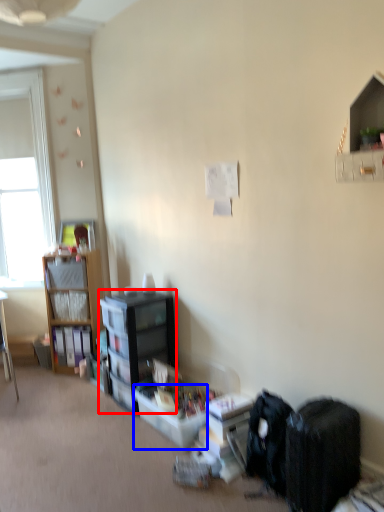
Question: Which object appears closest to the camera in this image, bookcase (highlighted by a red box) or storage box (highlighted by a blue box)?

Choices:
 (A) bookcase
 (B) storage box

Answer: (B)